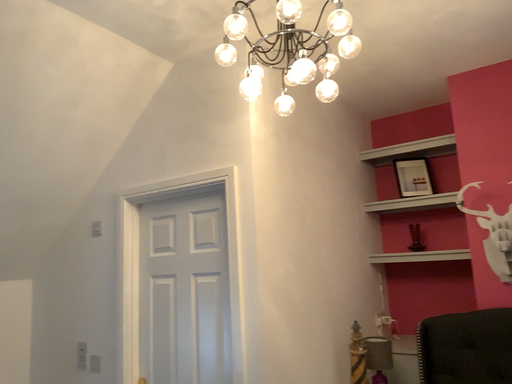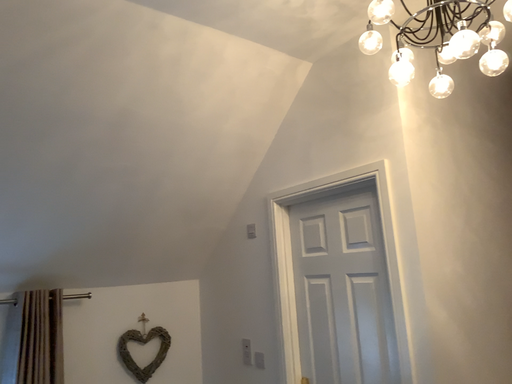
Question: Which way did the camera rotate in the video?

Choices:
 (A) rotated left
 (B) rotated right

Answer: (A)